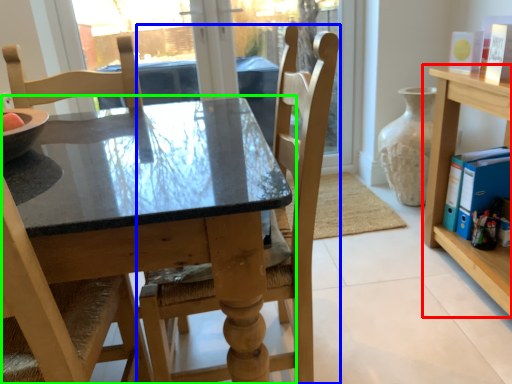
Question: Considering the real-world distances, which object is farthest from shelf (highlighted by a red box)? chair (highlighted by a blue box) or table (highlighted by a green box)?

Choices:
 (A) chair
 (B) table

Answer: (B)